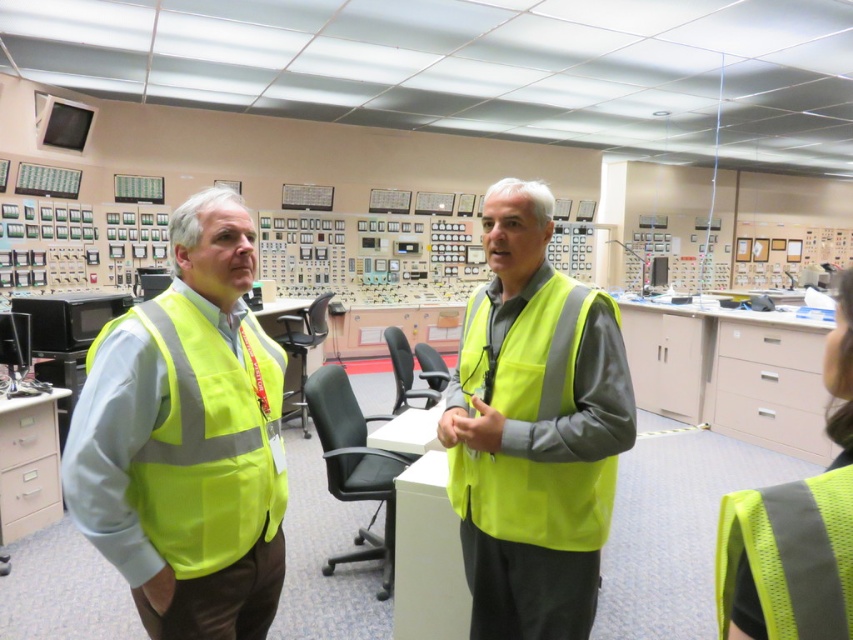
Question: Is high-visibility fabric safety vest at left positioned behind high-visibility fabric safety vest at center?

Choices:
 (A) yes
 (B) no

Answer: (B)

Question: Among these objects, which one is nearest to the camera?

Choices:
 (A) high-visibility fabric safety vest at left
 (B) high-visibility fabric safety vest at center

Answer: (A)

Question: Is high-visibility fabric safety vest at left below high-visibility fabric safety vest at center?

Choices:
 (A) no
 (B) yes

Answer: (B)

Question: Is high-visibility fabric safety vest at left in front of high-visibility fabric safety vest at center?

Choices:
 (A) yes
 (B) no

Answer: (A)